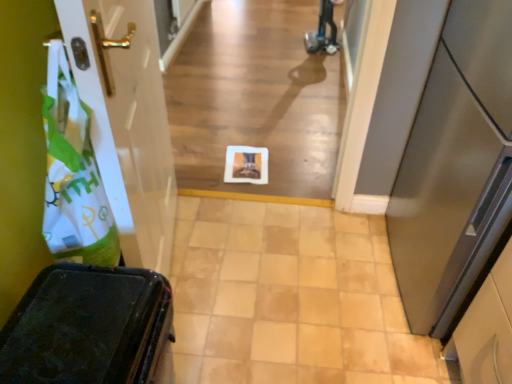
Question: Does white matte plastic bag at left have a greater width compared to white paper at center?

Choices:
 (A) no
 (B) yes

Answer: (A)

Question: Is white matte plastic bag at left outside white paper at center?

Choices:
 (A) yes
 (B) no

Answer: (A)

Question: Is white matte plastic bag at left behind white paper at center?

Choices:
 (A) no
 (B) yes

Answer: (A)

Question: Is white matte plastic bag at left bigger than white paper at center?

Choices:
 (A) yes
 (B) no

Answer: (B)

Question: Is white paper at center at the back of white matte plastic bag at left?

Choices:
 (A) yes
 (B) no

Answer: (B)

Question: Is satin silver door at right, which is counted as the second door, starting from the left, in front of or behind matte black suitcase at lower left in the image?

Choices:
 (A) front
 (B) behind

Answer: (B)

Question: From their relative heights in the image, would you say satin silver door at right, which is counted as the second door, starting from the left, is taller or shorter than matte black suitcase at lower left?

Choices:
 (A) short
 (B) tall

Answer: (B)

Question: Is satin silver door at right, arranged as the first door when viewed from the right, bigger or smaller than matte black suitcase at lower left?

Choices:
 (A) small
 (B) big

Answer: (B)

Question: Visually, is satin silver door at right, arranged as the first door when viewed from the right, positioned to the left or to the right of matte black suitcase at lower left?

Choices:
 (A) left
 (B) right

Answer: (B)

Question: Is point (287, 246) positioned closer to the camera than point (446, 72)?

Choices:
 (A) farther
 (B) closer

Answer: (A)

Question: Is beige tile floor at center taller or shorter than satin silver door at right, which is counted as the second door, starting from the left?

Choices:
 (A) tall
 (B) short

Answer: (B)

Question: Would you say beige tile floor at center is to the left or to the right of satin silver door at right, which is counted as the second door, starting from the left, in the picture?

Choices:
 (A) left
 (B) right

Answer: (A)

Question: From a real-world perspective, relative to satin silver door at right, which is counted as the second door, starting from the left, is beige tile floor at center vertically above or below?

Choices:
 (A) above
 (B) below

Answer: (B)

Question: Does point (177, 218) appear closer or farther from the camera than point (46, 223)?

Choices:
 (A) closer
 (B) farther

Answer: (B)

Question: Relative to white matte plastic bag at left, is beige tile floor at center in front or behind?

Choices:
 (A) front
 (B) behind

Answer: (B)